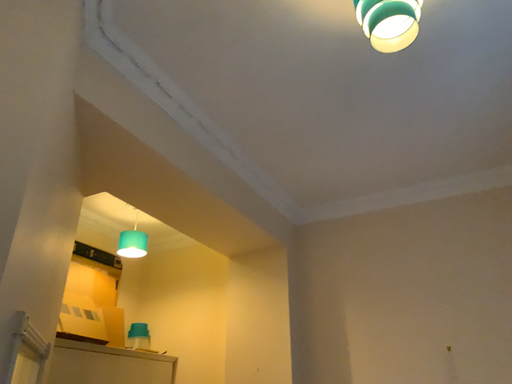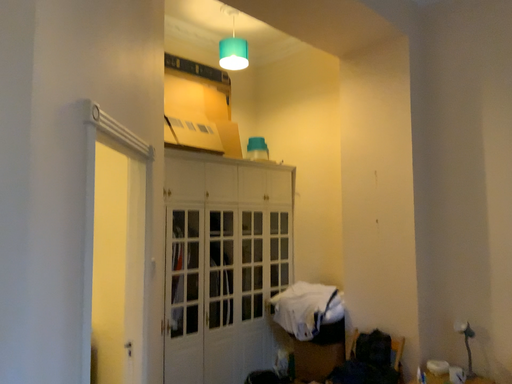
Question: How did the camera likely rotate when shooting the video?

Choices:
 (A) rotated right
 (B) rotated left

Answer: (B)